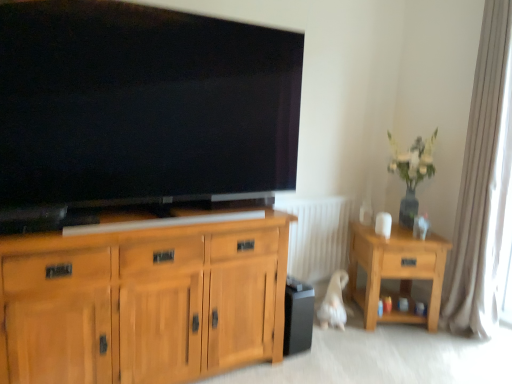
Question: Which is correct: black glossy tv at upper center is inside light oak wooden side table at right, or outside of it?

Choices:
 (A) inside
 (B) outside

Answer: (B)

Question: Is point (45, 26) positioned closer to the camera than point (387, 251)?

Choices:
 (A) farther
 (B) closer

Answer: (B)

Question: Based on their relative distances, which object is nearer to the green glossy vase at upper right?

Choices:
 (A) black glossy tv at upper center
 (B) white fabric curtain at right
 (C) white plastic radiator at center
 (D) light oak wooden side table at right
 (E) light wood cabinet at left

Answer: (D)

Question: Estimate the real-world distances between objects in this image. Which object is farther from the light wood cabinet at left?

Choices:
 (A) white fabric curtain at right
 (B) light oak wooden side table at right
 (C) white plastic radiator at center
 (D) black glossy tv at upper center
 (E) green glossy vase at upper right

Answer: (A)